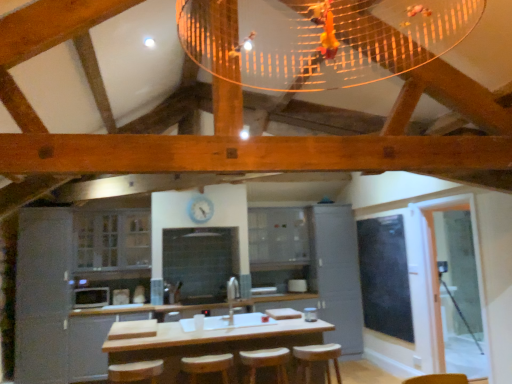
Locate an element on the screen. The image size is (512, 384). vacant region above wooden bar stool at center, the third bar stool in the left-to-right sequence (from a real-world perspective) is located at coordinates (314, 347).